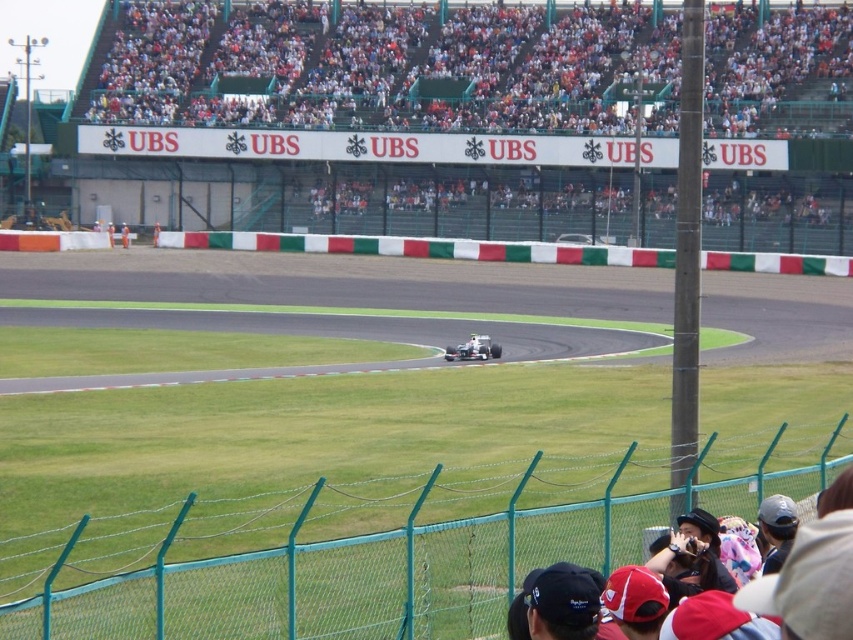
Between black fabric cap at lower center and white fabric person at center, which one has more height?

With more height is black fabric cap at lower center.

Identify the location of black fabric cap at lower center. Image resolution: width=853 pixels, height=640 pixels. (556, 604).

Who is more distant from viewer, (657, 97) or (109, 227)?

The point (109, 227) is behind.

Which is above, white plastic seats at upper center or white plastic helmet at center?

white plastic seats at upper center

The image size is (853, 640). I want to click on white plastic seats at upper center, so click(389, 67).

Does white plastic seats at upper center appear over black fabric cap at lower center?

Yes, white plastic seats at upper center is above black fabric cap at lower center.

This screenshot has width=853, height=640. Describe the element at coordinates (389, 67) in the screenshot. I see `white plastic seats at upper center` at that location.

The height and width of the screenshot is (640, 853). I want to click on white plastic seats at upper center, so click(x=389, y=67).